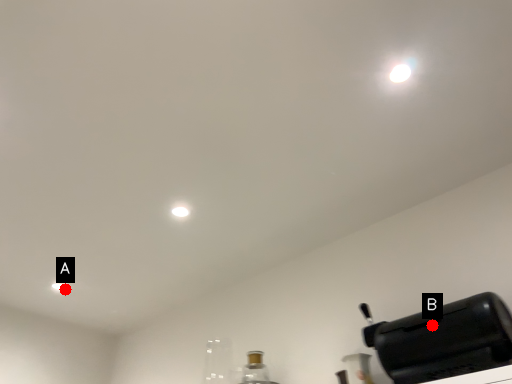
Question: Two points are circled on the image, labeled by A and B beside each circle. Which point is closer to the camera taking this photo?

Choices:
 (A) A is closer
 (B) B is closer

Answer: (B)